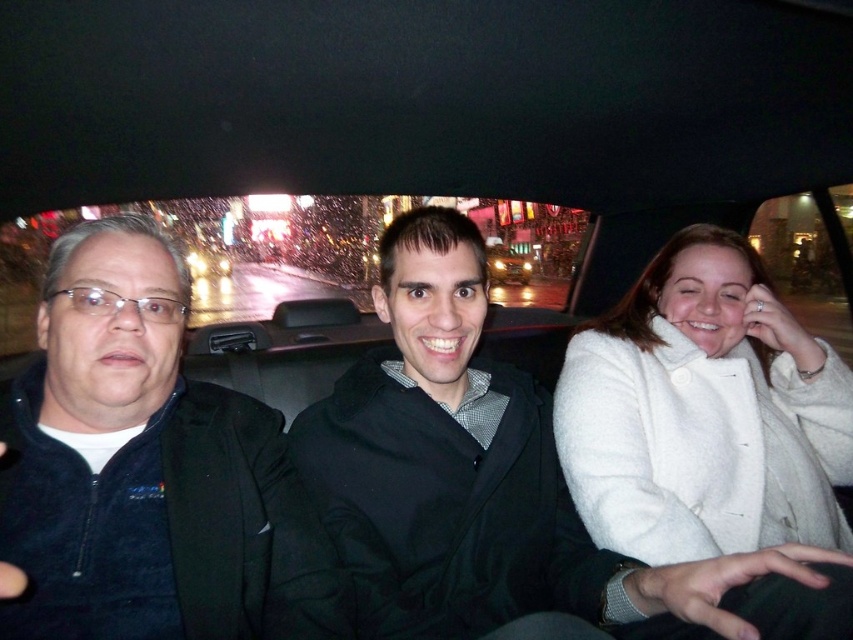
You are a delivery driver who needs to determine the seating arrangement of the passengers in the car. The car has three seats. The middle seat is between the left and right seats. You observe the matte black jacket at center and the dark blue fleece jacket at left. Which passenger is sitting in the middle seat?

The passenger wearing the matte black jacket at center is sitting in the middle seat because the matte black jacket at center is positioned at the center of the car.

You are a fashion designer observing a car scene at night. You notice two coats in the image. Which coat is shorter, the matte black jacket at center or the white wool coat at right?

The matte black jacket at center is shorter than the white wool coat at right.

Consider the image. You are a passenger in a car at night. You notice a point at coordinates (502, 486). Based on the scene description, where is this point located?

The point at coordinates (502, 486) is located on the matte black jacket at center.